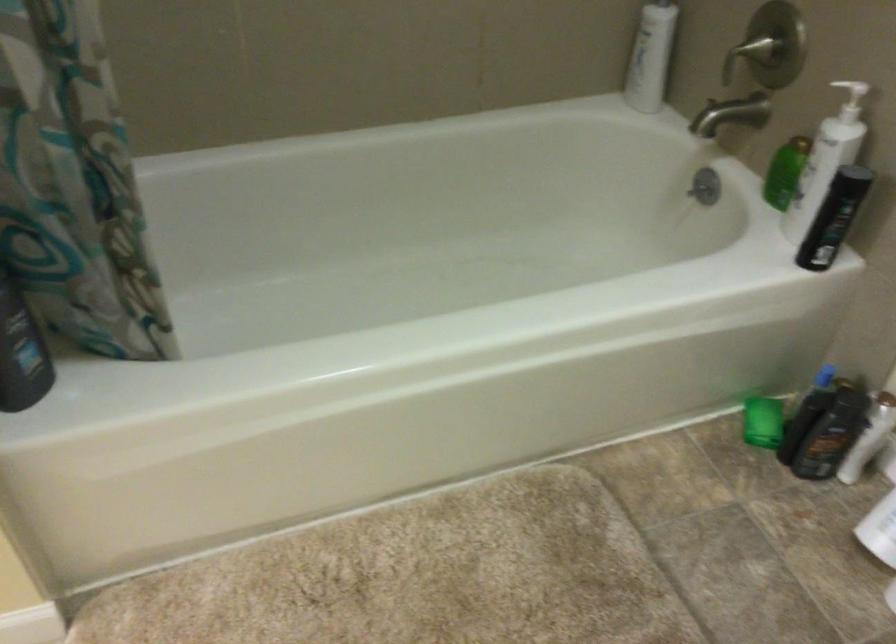
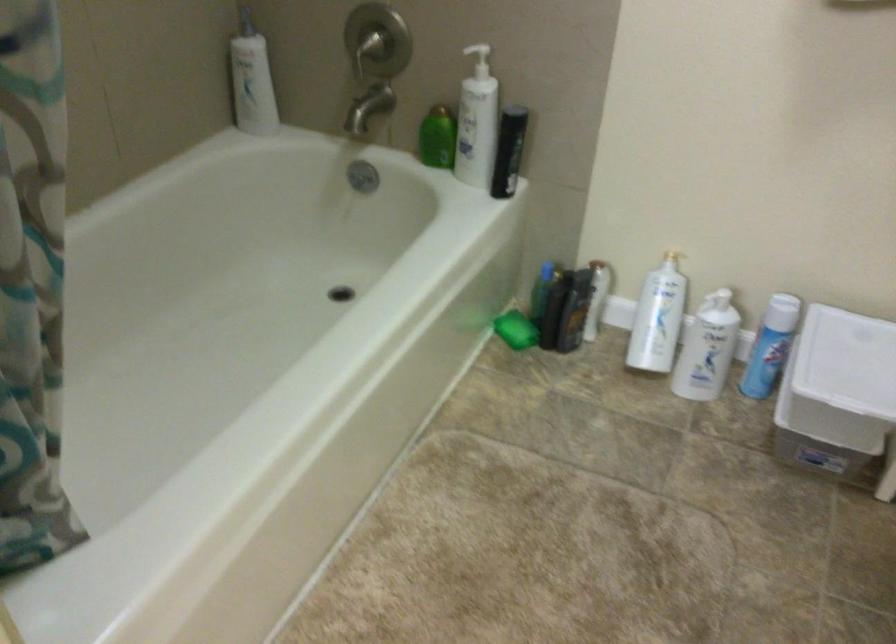
Where in the second image is the point corresponding to point (702, 187) from the first image?

(362, 176)